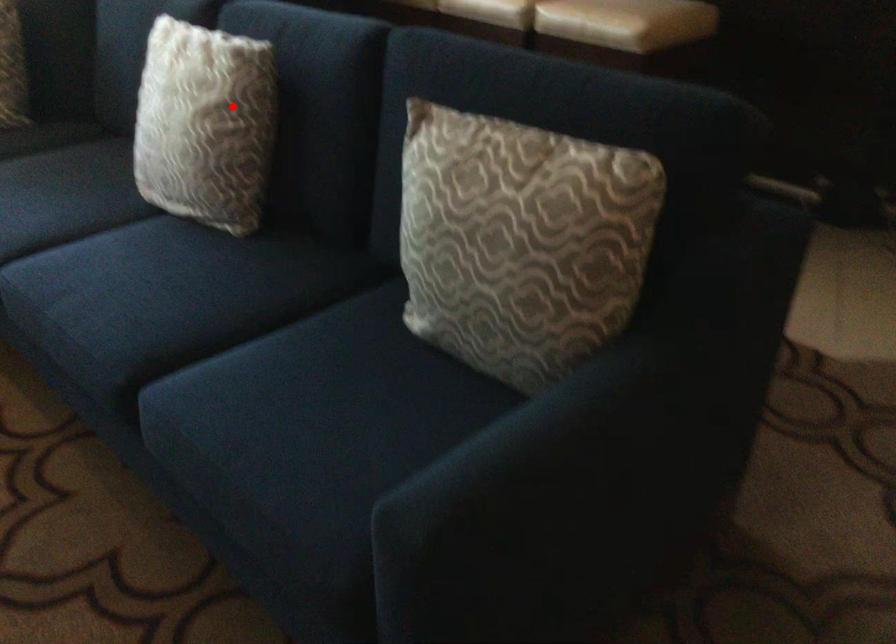
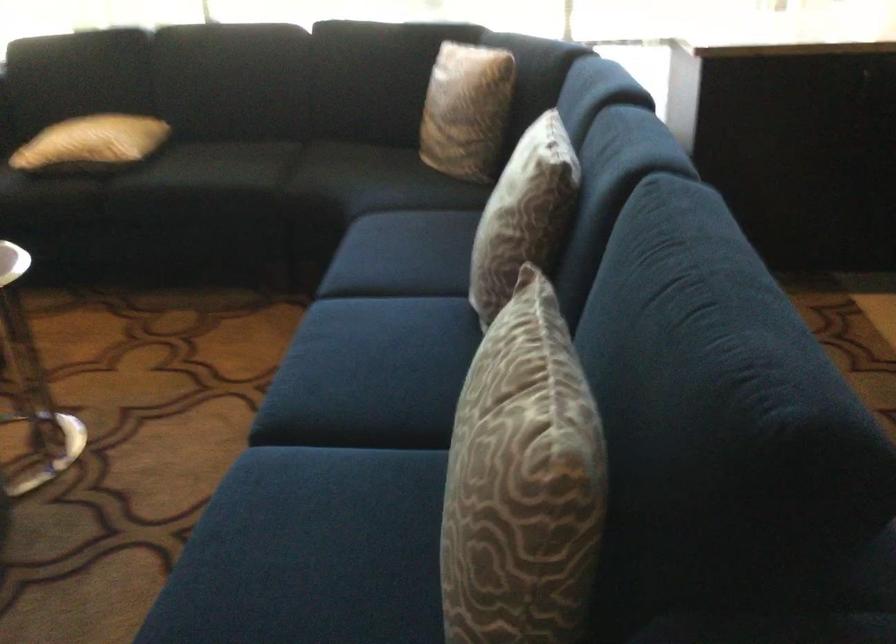
In the second image, find the point that corresponds to the highlighted location in the first image.

(523, 213)